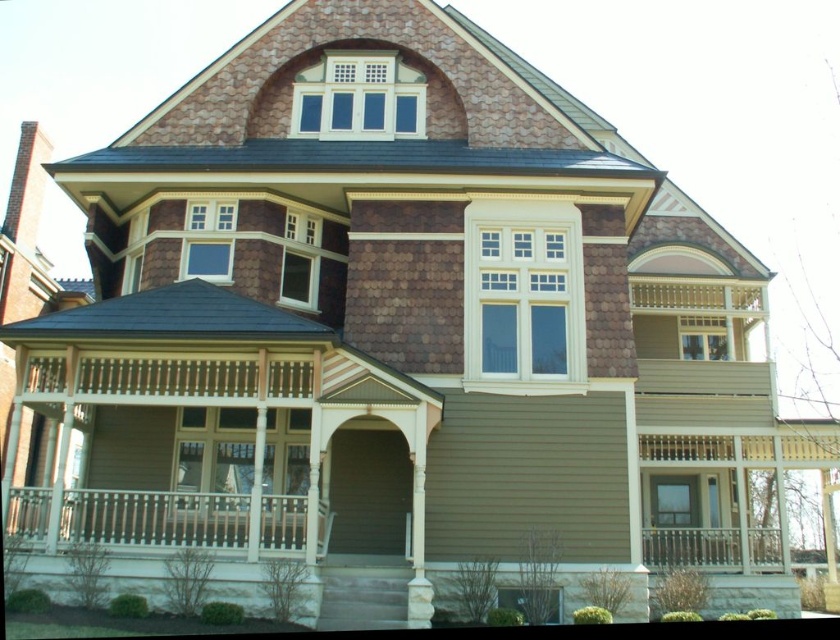
Question: Which point is closer to the camera taking this photo?

Choices:
 (A) (151, 513)
 (B) (683, 548)

Answer: (A)

Question: Does white wooden balustrade at lower left appear on the right side of white painted wood balustrade at lower right?

Choices:
 (A) no
 (B) yes

Answer: (A)

Question: Can you confirm if white wooden balustrade at lower left is positioned to the right of white painted wood balustrade at lower right?

Choices:
 (A) no
 (B) yes

Answer: (A)

Question: Does white wooden balustrade at lower left appear on the left side of white painted wood balustrade at lower right?

Choices:
 (A) yes
 (B) no

Answer: (A)

Question: Which of the following is the farthest from the observer?

Choices:
 (A) (675, 532)
 (B) (281, 508)

Answer: (A)